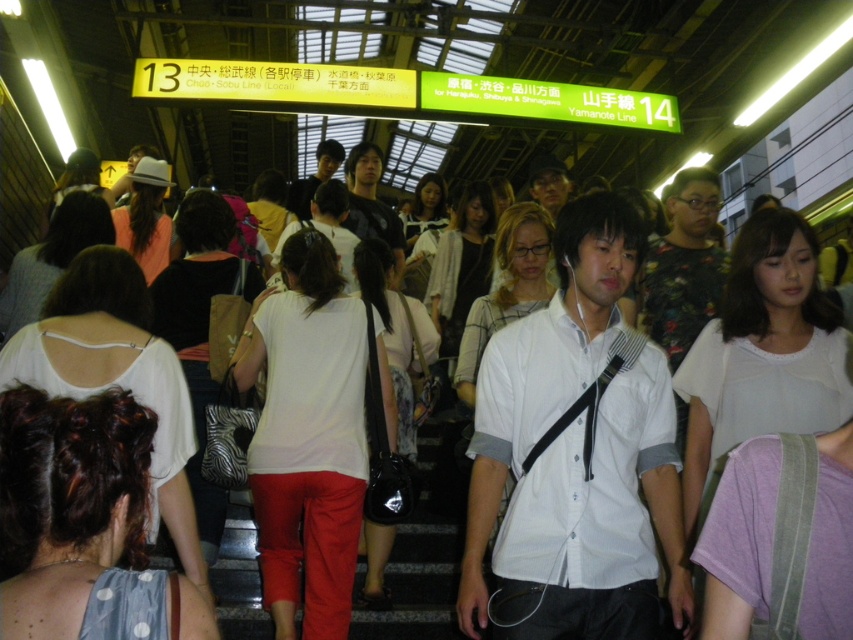
You are standing at the entrance of the train station and notice a white fabric at center and a matte black bag at center. Which one is closer to you?

The white fabric at center is 13.31 meters away from the matte black bag at center. Since you are at the entrance, the distance between them doesn

You are a traveler in the train station and you see the white fabric at center and the matte black bag at center. Which item is covering the other?

The white fabric at center is positioned over matte black bag at center, so the white fabric is covering the matte black bag.